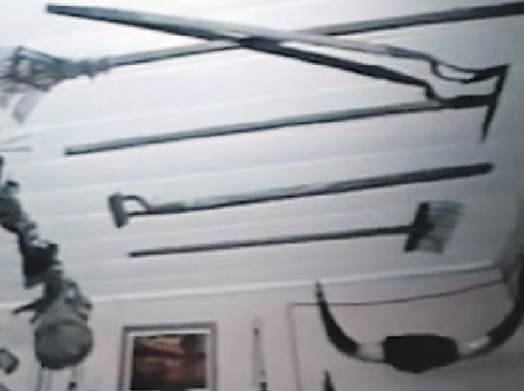
The width and height of the screenshot is (524, 391). In order to click on white paneled ceiling in this screenshot , I will do `click(233, 158)`.